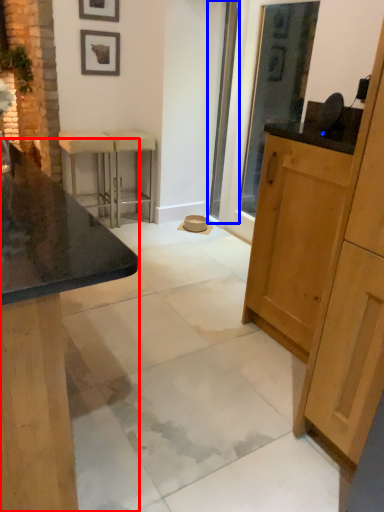
Question: Among these objects, which one is nearest to the camera, cabinetry (highlighted by a red box) or screen door (highlighted by a blue box)?

Choices:
 (A) cabinetry
 (B) screen door

Answer: (A)